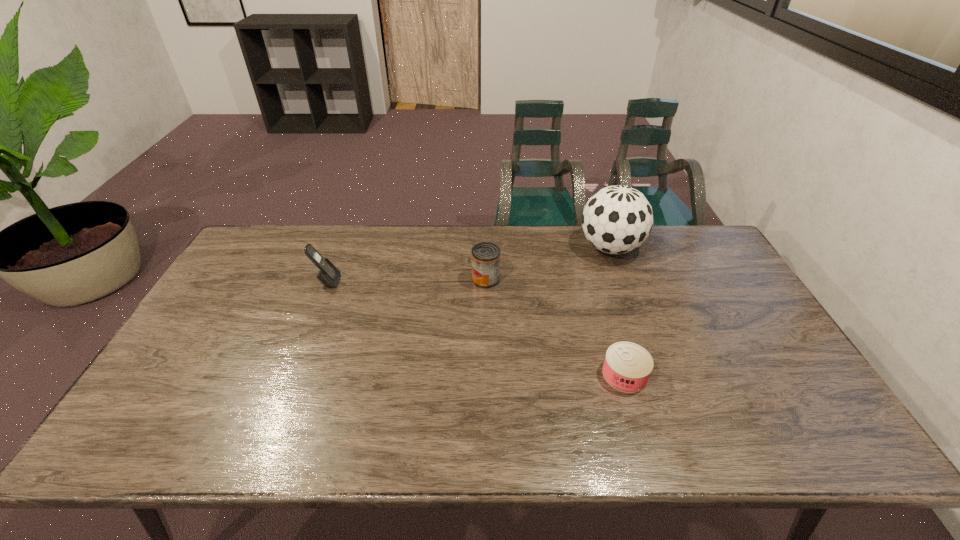
Find the location of a particular element. Image resolution: width=960 pixels, height=540 pixels. soccer ball is located at coordinates (617, 219).

What are the coordinates of `the farthest object` in the screenshot? It's located at (617, 219).

Where is `the third shortest object`? This screenshot has width=960, height=540. the third shortest object is located at coordinates (328, 275).

In order to click on cellular telephone in this screenshot , I will do `click(328, 275)`.

The image size is (960, 540). Find the location of `the third object from right to left`. the third object from right to left is located at coordinates (485, 256).

Find the location of `the left can`. the left can is located at coordinates (485, 256).

You are a GUI agent. You are given a task and a screenshot of the screen. Output one action in this format:
    pyautogui.click(x=<x>, y=<y>)
    Task: Click on the shortest object
    Image resolution: width=960 pixels, height=540 pixels.
    Given the screenshot: What is the action you would take?
    pyautogui.click(x=627, y=366)

This screenshot has height=540, width=960. I want to click on the nearest object, so click(627, 366).

The width and height of the screenshot is (960, 540). I want to click on vacant space situated on the right of the farthest object, so pos(683,247).

Locate an element on the screen. This screenshot has width=960, height=540. vacant space located 0.370m on the front-facing side of the leftmost object is located at coordinates click(x=456, y=281).